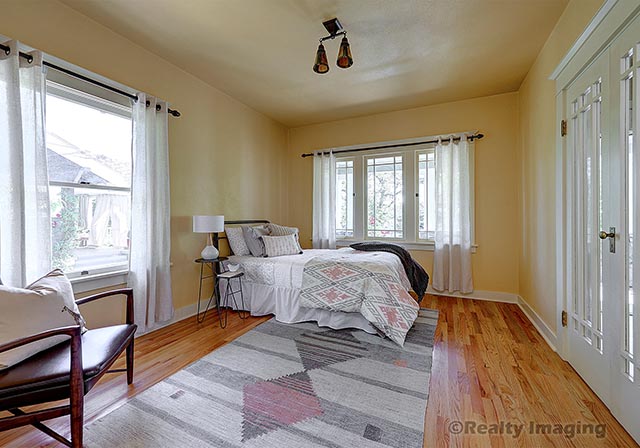
You are a GUI agent. You are given a task and a screenshot of the screen. Output one action in this format:
    pyautogui.click(x=<x>, y=<y>)
    Task: Click on the curtains
    The image size is (640, 448).
    Given the screenshot: What is the action you would take?
    pyautogui.click(x=442, y=246), pyautogui.click(x=324, y=238), pyautogui.click(x=161, y=265), pyautogui.click(x=26, y=257)